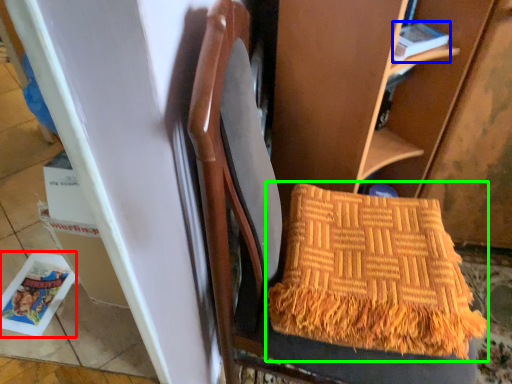
Question: Estimate the real-world distances between objects in this image. Which object is closer to magazine (highlighted by a red box), magazine (highlighted by a blue box) or blanket (highlighted by a green box)?

Choices:
 (A) magazine
 (B) blanket

Answer: (B)